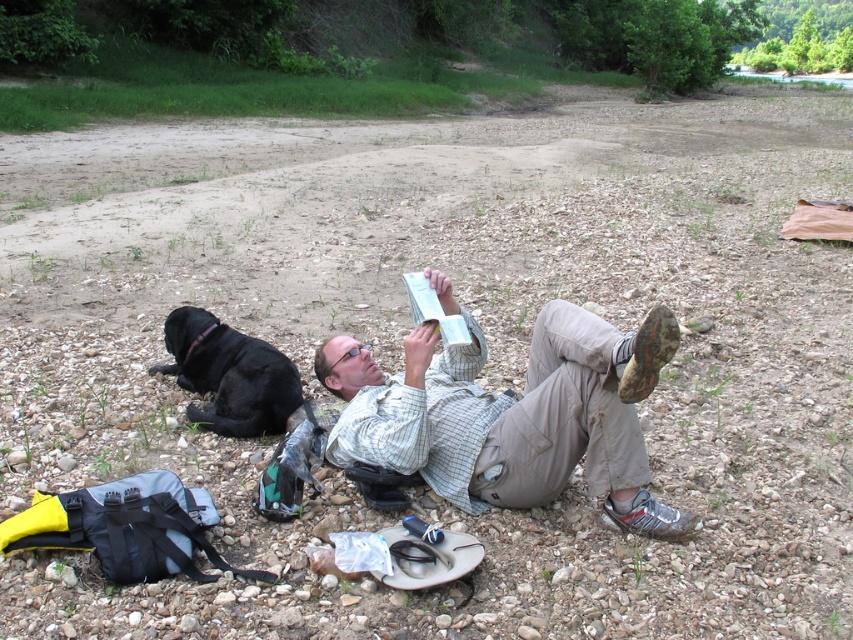
Question: Is the position of light brown cotton shirt at center less distant than that of black fur dog at lower left?

Choices:
 (A) no
 (B) yes

Answer: (B)

Question: Which point is farther from the camera taking this photo?

Choices:
 (A) (193, 365)
 (B) (569, 342)

Answer: (A)

Question: Which point is farther to the camera?

Choices:
 (A) (654, 356)
 (B) (210, 376)

Answer: (B)

Question: Can you confirm if light brown cotton shirt at center is thinner than black fur dog at lower left?

Choices:
 (A) no
 (B) yes

Answer: (A)

Question: Can you confirm if light brown cotton shirt at center is thinner than black fur dog at lower left?

Choices:
 (A) no
 (B) yes

Answer: (A)